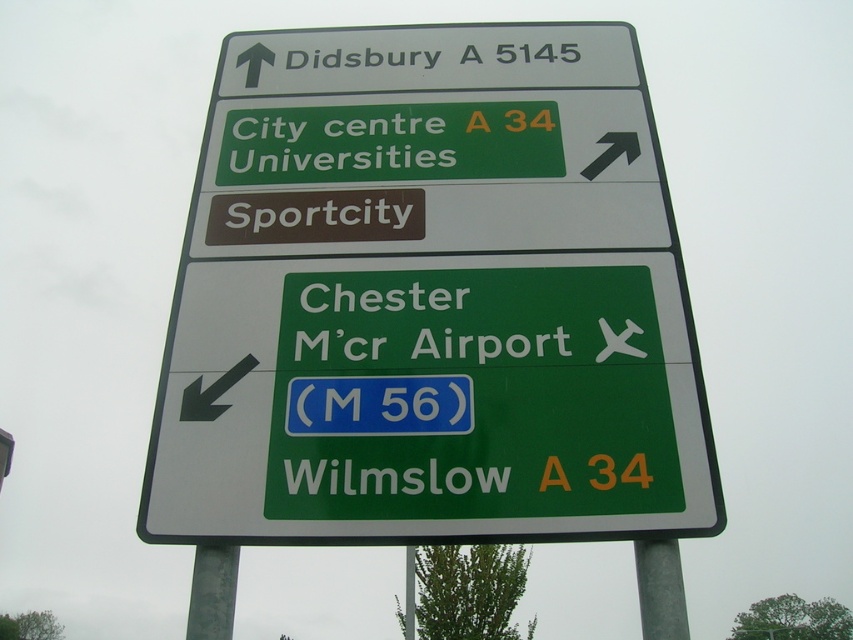
The height and width of the screenshot is (640, 853). What are the coordinates of `gray metallic pole at lower right` in the screenshot? It's located at (660, 589).

What do you see at coordinates (660, 589) in the screenshot? I see `gray metallic pole at lower right` at bounding box center [660, 589].

The image size is (853, 640). In order to click on gray metallic pole at lower right in this screenshot , I will do `click(660, 589)`.

Can you confirm if green plastic sign at upper center is thinner than gray metallic pole at lower right?

No.

Is point (590, 227) closer to viewer compared to point (642, 595)?

No, (590, 227) is behind (642, 595).

Is point (460, 208) positioned before point (660, 609)?

No, (460, 208) is further to viewer.

Where is `green plastic sign at upper center`? green plastic sign at upper center is located at coordinates (430, 300).

Who is taller, green plastic sign at upper center or metallic gray pole at lower center?

green plastic sign at upper center is taller.

Who is higher up, green plastic sign at upper center or metallic gray pole at lower center?

green plastic sign at upper center is higher up.

Between point (444, 413) and point (192, 637), which one is positioned in front?

Point (192, 637)

Image resolution: width=853 pixels, height=640 pixels. Identify the location of green plastic sign at upper center. tap(430, 300).